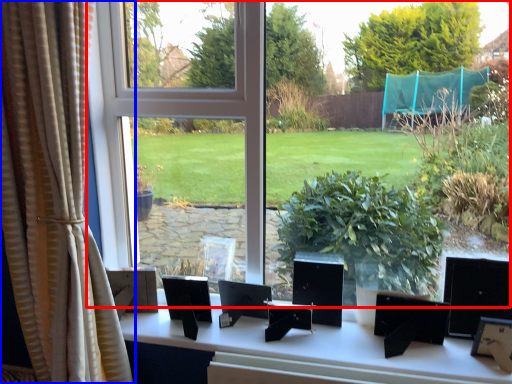
Question: Which object appears farthest to the camera in this image, window (highlighted by a red box) or curtain (highlighted by a blue box)?

Choices:
 (A) window
 (B) curtain

Answer: (A)